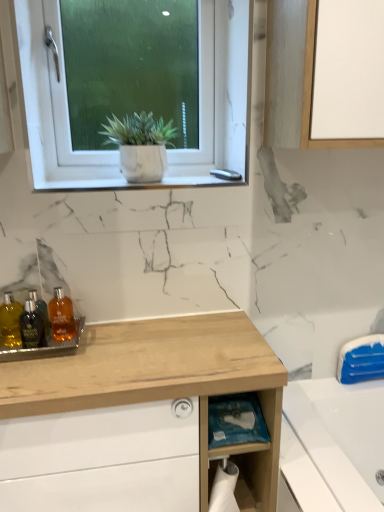
In order to face translucent amber bottle at lower left, should I rotate leftwards or rightwards?

Turn left approximately 20.855 degrees to face it.

Measure the distance between white matte window at upper center and camera.

1.01 meters.

What do you see at coordinates (141, 145) in the screenshot? I see `white marble plant pot at upper center` at bounding box center [141, 145].

The height and width of the screenshot is (512, 384). Describe the element at coordinates (165, 384) in the screenshot. I see `wooden cabinet at lower left` at that location.

Where is `translucent amber bottle at center, placed as the third toiletry when sorted from left to right`? translucent amber bottle at center, placed as the third toiletry when sorted from left to right is located at coordinates (61, 316).

Could you tell me if wooden cabinet at lower left is turned towards white matte window at upper center?

No, wooden cabinet at lower left is not turned towards white matte window at upper center.

Is there a large distance between wooden cabinet at lower left and white matte window at upper center?

They are positioned close to each other.

Which is closer, (240,507) or (221,15)?

Clearly, point (240,507) is closer to the camera than point (221,15).

From the image's perspective, would you say wooden cabinet at lower left is shown under white matte window at upper center?

Yes, from the image's perspective, wooden cabinet at lower left is beneath white matte window at upper center.

Looking at this image, from the image's perspective, relative to translucent amber bottle at center, placed as the third toiletry when sorted from left to right, is white marble window sill at upper center above or below?

Based on their image positions, white marble window sill at upper center is located above translucent amber bottle at center, placed as the third toiletry when sorted from left to right.

Can translucent amber bottle at center, placed as the first toiletry when sorted from right to left, be found inside white marble window sill at upper center?

No, translucent amber bottle at center, placed as the first toiletry when sorted from right to left, is not inside white marble window sill at upper center.

The width and height of the screenshot is (384, 512). Identify the location of the 2nd toiletry below when counting from the white marble window sill at upper center (from the image's perspective). (10, 321).

Between shiny glass bottles at left, the first toiletry in the left-to-right sequence, and white marble window sill at upper center, which one has smaller size?

shiny glass bottles at left, the first toiletry in the left-to-right sequence.

In the scene shown: From the image's perspective, is shiny glass bottles at left, the 3th toiletry when ordered from right to left, located above or below white marble window sill at upper center?

shiny glass bottles at left, the 3th toiletry when ordered from right to left, is below white marble window sill at upper center.

Where is `toiletry located behind the shiny glass bottles at left, the 3th toiletry when ordered from right to left`? The height and width of the screenshot is (512, 384). toiletry located behind the shiny glass bottles at left, the 3th toiletry when ordered from right to left is located at coordinates tap(61, 316).

From a real-world perspective, which is physically below, translucent amber bottle at center, placed as the first toiletry when sorted from right to left, or shiny glass bottles at left, the 3th toiletry when ordered from right to left?

From a 3D spatial view, translucent amber bottle at center, placed as the first toiletry when sorted from right to left, is below.

Is translucent amber bottle at center, placed as the first toiletry when sorted from right to left, positioned behind shiny glass bottles at left, the 3th toiletry when ordered from right to left?

Yes, the depth of translucent amber bottle at center, placed as the first toiletry when sorted from right to left, is greater than that of shiny glass bottles at left, the 3th toiletry when ordered from right to left.

From the image's perspective, is translucent amber bottle at center, placed as the first toiletry when sorted from right to left, on shiny glass bottles at left, the first toiletry in the left-to-right sequence?

Yes.

In terms of width, does shiny glass bottles at left, the 3th toiletry when ordered from right to left, look wider or thinner when compared to blue plastic bag at lower center?

In the image, shiny glass bottles at left, the 3th toiletry when ordered from right to left, appears to be more narrow than blue plastic bag at lower center.

Considering the positions of point (11, 340) and point (267, 438), is point (11, 340) closer or farther from the camera than point (267, 438)?

Point (11, 340).

In terms of size, does shiny glass bottles at left, the first toiletry in the left-to-right sequence, appear bigger or smaller than blue plastic bag at lower center?

shiny glass bottles at left, the first toiletry in the left-to-right sequence, is smaller than blue plastic bag at lower center.

How much distance is there between white marble plant pot at upper center and shiny glass bottles at left, the 3th toiletry when ordered from right to left?

white marble plant pot at upper center and shiny glass bottles at left, the 3th toiletry when ordered from right to left, are 21.63 inches apart from each other.

Find the location of a particular element. This screenshot has width=384, height=512. houseplant located above the shiny glass bottles at left, the first toiletry in the left-to-right sequence (from the image's perspective) is located at coordinates click(x=141, y=145).

Considering the relative sizes of white marble plant pot at upper center and shiny glass bottles at left, the 3th toiletry when ordered from right to left, in the image provided, is white marble plant pot at upper center shorter than shiny glass bottles at left, the 3th toiletry when ordered from right to left,?

In fact, white marble plant pot at upper center may be taller than shiny glass bottles at left, the 3th toiletry when ordered from right to left.

Would you consider white marble plant pot at upper center to be distant from shiny glass bottles at left, the first toiletry in the left-to-right sequence?

No, white marble plant pot at upper center is not far away from shiny glass bottles at left, the first toiletry in the left-to-right sequence.

Could you tell me if blue plastic bag at lower center is facing translucent plastic bottles at lower left, which is counted as the 2th toiletry, starting from the right?

No.

In the image, is blue plastic bag at lower center positioned in front of or behind translucent plastic bottles at lower left, which ranks as the second toiletry in left-to-right order?

blue plastic bag at lower center is positioned farther from the viewer than translucent plastic bottles at lower left, which ranks as the second toiletry in left-to-right order.

Considering the positions of objects blue plastic bag at lower center and translucent plastic bottles at lower left, which is counted as the 2th toiletry, starting from the right, in the image provided, who is more to the right, blue plastic bag at lower center or translucent plastic bottles at lower left, which is counted as the 2th toiletry, starting from the right,?

blue plastic bag at lower center.

Does blue plastic bag at lower center have a lesser height compared to translucent plastic bottles at lower left, which ranks as the second toiletry in left-to-right order?

In fact, blue plastic bag at lower center may be taller than translucent plastic bottles at lower left, which ranks as the second toiletry in left-to-right order.

Find the location of a particular element. The height and width of the screenshot is (512, 384). bathroom cabinet lying below the white matte window at upper center (from the image's perspective) is located at coordinates (165, 384).

This screenshot has width=384, height=512. Identify the location of window sill to the right of translucent amber bottle at center, placed as the third toiletry when sorted from left to right. (138, 183).

Looking at the image, which one is located further to wooden cabinet at lower left, white marble plant pot at upper center or blue plastic bag at lower center?

The object further to wooden cabinet at lower left is white marble plant pot at upper center.

Looking at the image, which one is located further to translucent amber bottle at center, placed as the first toiletry when sorted from right to left, translucent plastic bottles at lower left, which ranks as the second toiletry in left-to-right order, or shiny glass bottles at left, the first toiletry in the left-to-right sequence?

shiny glass bottles at left, the first toiletry in the left-to-right sequence, is further to translucent amber bottle at center, placed as the first toiletry when sorted from right to left.

Considering their positions, is white marble plant pot at upper center positioned further to blue plastic bag at lower center than translucent plastic bottles at lower left, which is counted as the 2th toiletry, starting from the right?

white marble plant pot at upper center is positioned further to the anchor blue plastic bag at lower center.

Estimate the real-world distances between objects in this image. Which object is closer to translucent amber bottle at lower left, shiny glass bottles at left, the 3th toiletry when ordered from right to left, or white matte window at upper center?

The object closer to translucent amber bottle at lower left is shiny glass bottles at left, the 3th toiletry when ordered from right to left.

Estimate the real-world distances between objects in this image. Which object is closer to translucent plastic bottles at lower left, which is counted as the 2th toiletry, starting from the right, wooden cabinet at lower left or translucent amber bottle at center, placed as the first toiletry when sorted from right to left?

translucent amber bottle at center, placed as the first toiletry when sorted from right to left.

When comparing their distances from translucent amber bottle at lower left, does wooden cabinet at lower left or white marble plant pot at upper center seem closer?

wooden cabinet at lower left lies closer to translucent amber bottle at lower left than the other object.

Looking at the image, which one is located further to translucent amber bottle at center, placed as the first toiletry when sorted from right to left, white marble plant pot at upper center or shiny glass bottles at left, the 3th toiletry when ordered from right to left?

white marble plant pot at upper center is further to translucent amber bottle at center, placed as the first toiletry when sorted from right to left.

Looking at the image, which one is located further to translucent amber bottle at center, placed as the third toiletry when sorted from left to right, shiny glass bottles at left, the 3th toiletry when ordered from right to left, or white matte window at upper center?

white matte window at upper center is positioned further to the anchor translucent amber bottle at center, placed as the third toiletry when sorted from left to right.

What are the coordinates of `window sill between white matte window at upper center and wooden cabinet at lower left in the vertical direction` in the screenshot? It's located at (138, 183).

Identify the location of houseplant between white matte window at upper center and translucent amber bottle at center, placed as the first toiletry when sorted from right to left, from top to bottom. The height and width of the screenshot is (512, 384). click(x=141, y=145).

Where is `bottle between white marble plant pot at upper center and translucent plastic bottles at lower left, which ranks as the second toiletry in left-to-right order, vertically`? bottle between white marble plant pot at upper center and translucent plastic bottles at lower left, which ranks as the second toiletry in left-to-right order, vertically is located at coordinates (32, 326).

At what (x,y) coordinates should I click in order to perform the action: click on bottle that lies between white matte window at upper center and blue plastic bag at lower center from top to bottom. Please return your answer as a coordinate pair (x, y). This screenshot has width=384, height=512. Looking at the image, I should click on (32, 326).